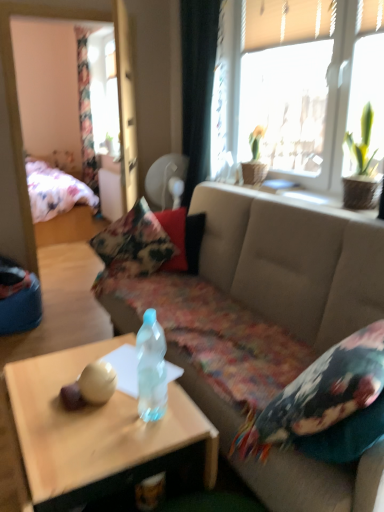
Identify the location of vacant space in front of translucent plastic bottle at center. The image size is (384, 512). (137, 444).